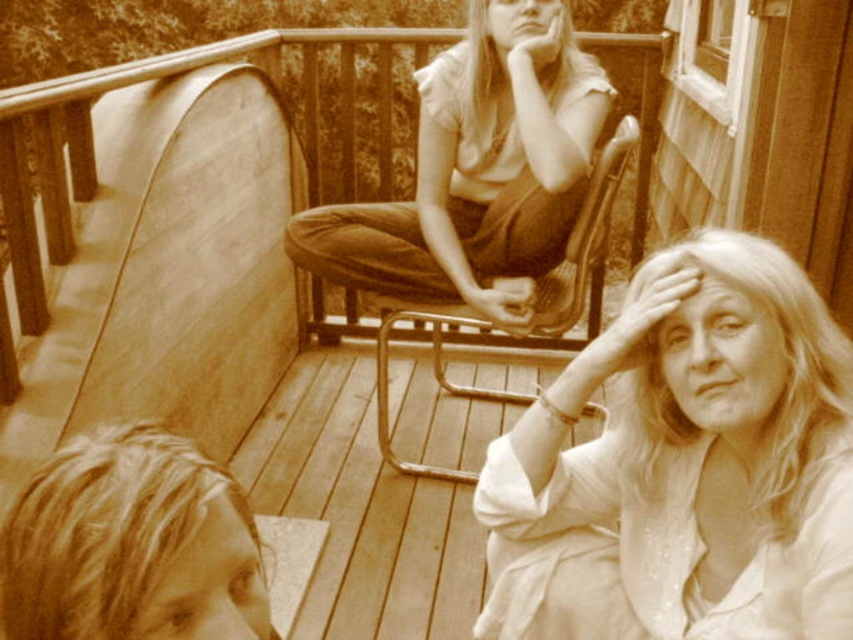
Question: Which of the following is the farthest from the observer?

Choices:
 (A) metallic frame chair at center
 (B) smooth white blouse at lower right
 (C) blonde hair at lower left

Answer: (A)

Question: Is matte brown pants at center wider than blonde hair at lower left?

Choices:
 (A) yes
 (B) no

Answer: (A)

Question: Observing the image, what is the correct spatial positioning of smooth white blouse at lower right in reference to matte brown pants at center?

Choices:
 (A) below
 (B) above

Answer: (A)

Question: Which point is closer to the camera?

Choices:
 (A) matte brown pants at center
 (B) blonde hair at lower left
 (C) metallic frame chair at center

Answer: (B)

Question: Is smooth white blouse at lower right smaller than matte brown pants at center?

Choices:
 (A) yes
 (B) no

Answer: (A)

Question: Which point is closer to the camera?

Choices:
 (A) smooth white blouse at lower right
 (B) blonde hair at lower left

Answer: (B)